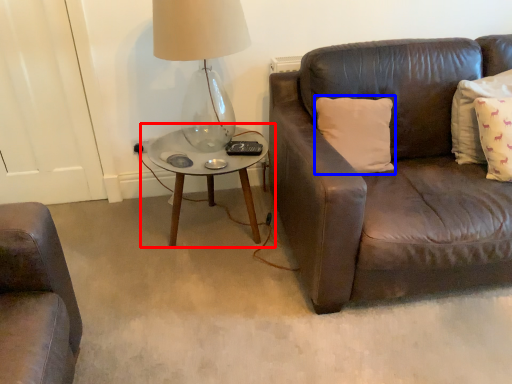
Question: Which object appears closest to the camera in this image, coffee table (highlighted by a red box) or pillow (highlighted by a blue box)?

Choices:
 (A) coffee table
 (B) pillow

Answer: (B)